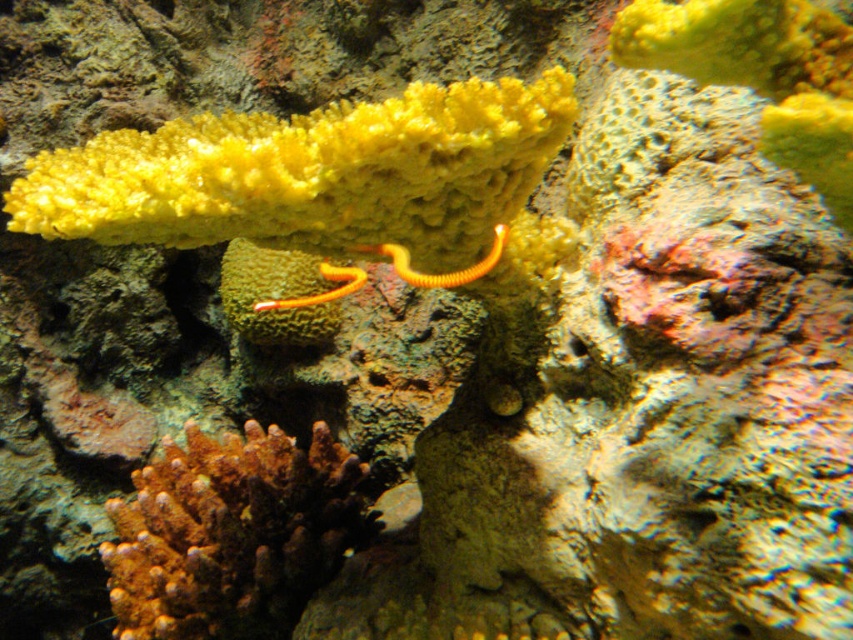
Question: Can you confirm if orange coral at center is positioned above yellow rubber worm at center?

Choices:
 (A) yes
 (B) no

Answer: (B)

Question: Does orange coral at center have a lesser width compared to yellow rubber worm at center?

Choices:
 (A) no
 (B) yes

Answer: (A)

Question: Can you confirm if orange coral at center is positioned above yellow rubber worm at center?

Choices:
 (A) no
 (B) yes

Answer: (A)

Question: Which point is farther to the camera?

Choices:
 (A) yellow rubber worm at center
 (B) orange coral at center

Answer: (B)